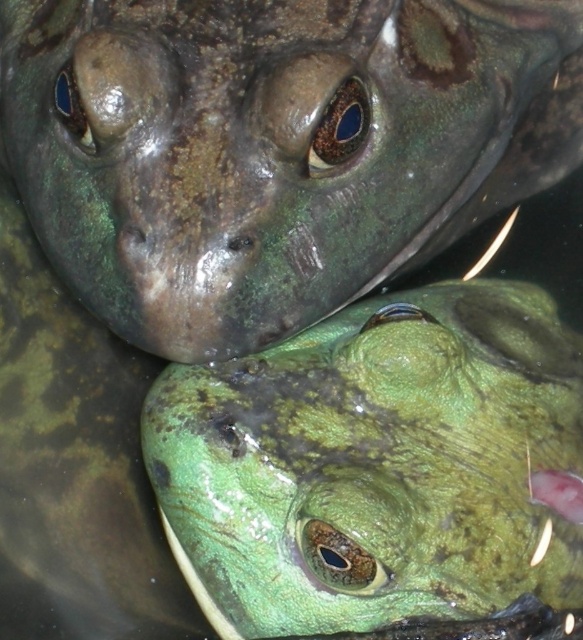
Question: Which point is farther to the camera?

Choices:
 (A) green matte skin at center
 (B) green matte skin at upper center

Answer: (A)

Question: From the image, what is the correct spatial relationship of green matte skin at upper center in relation to green matte skin at center?

Choices:
 (A) below
 (B) above

Answer: (B)

Question: Among these objects, which one is farthest from the camera?

Choices:
 (A) green matte skin at upper center
 (B) green matte skin at center

Answer: (B)

Question: Which object appears closest to the camera in this image?

Choices:
 (A) green matte skin at center
 (B) green matte skin at upper center

Answer: (B)

Question: Does green matte skin at upper center have a smaller size compared to green matte skin at center?

Choices:
 (A) yes
 (B) no

Answer: (B)

Question: Can you confirm if green matte skin at upper center is positioned above green matte skin at center?

Choices:
 (A) no
 (B) yes

Answer: (B)